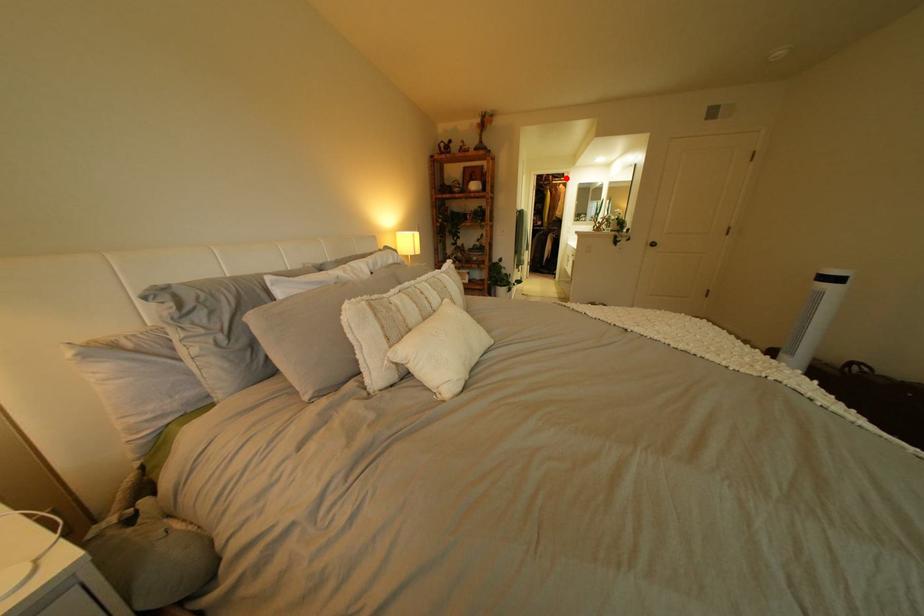
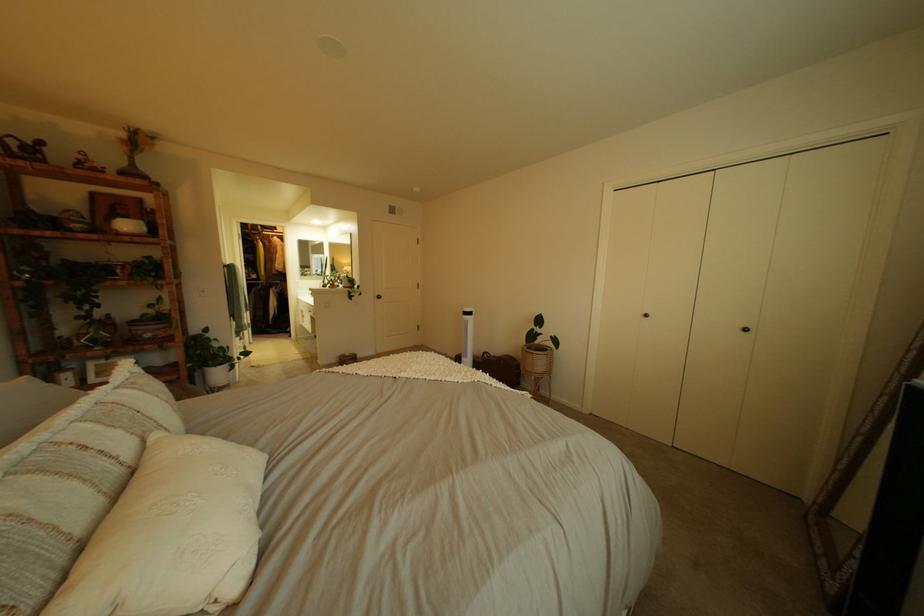
Question: I am providing you with two images of the same scene from different viewpoints. Given a red point in image1, look at the same physical point in image2. Is it:

Choices:
 (A) Closer to the viewpoint
 (B) Farther from the viewpoint

Answer: (B)